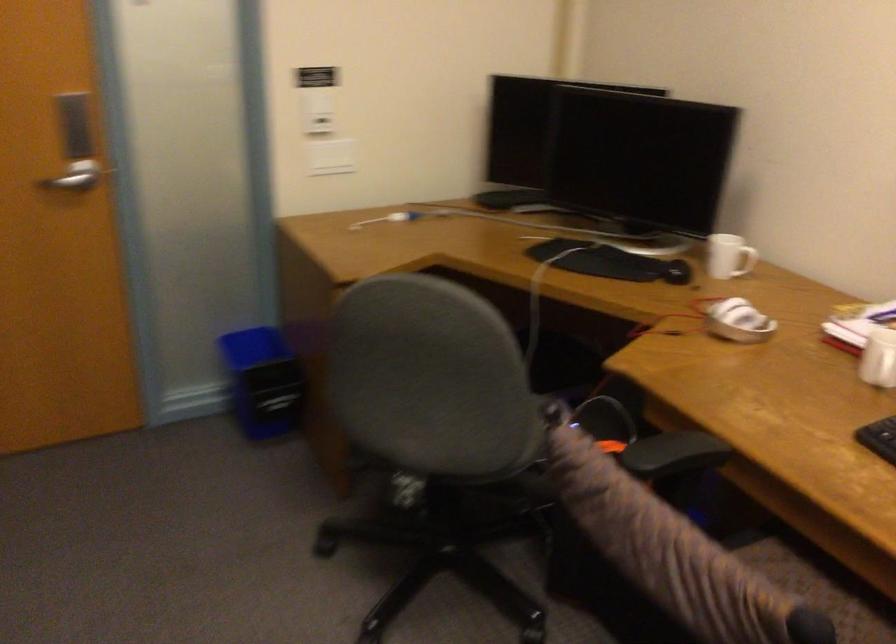
Find the location of a particular element. The width and height of the screenshot is (896, 644). blue trash can is located at coordinates (262, 382).